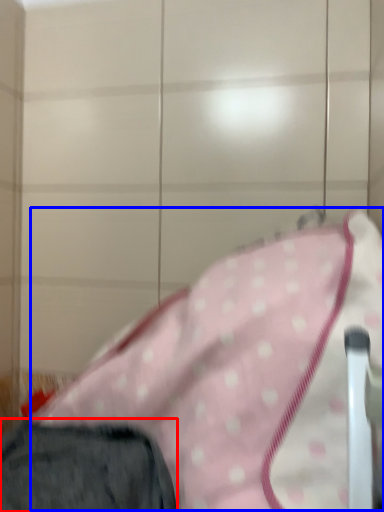
Question: Which object appears farthest to the camera in this image, trousers (highlighted by a red box) or blanket (highlighted by a blue box)?

Choices:
 (A) trousers
 (B) blanket

Answer: (B)